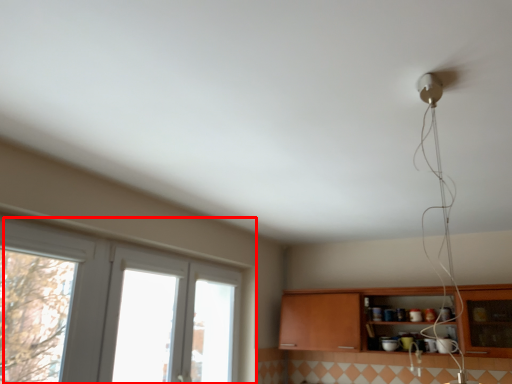
Question: Where is window (annotated by the red box) located in relation to cabinetry in the image?

Choices:
 (A) right
 (B) left

Answer: (B)